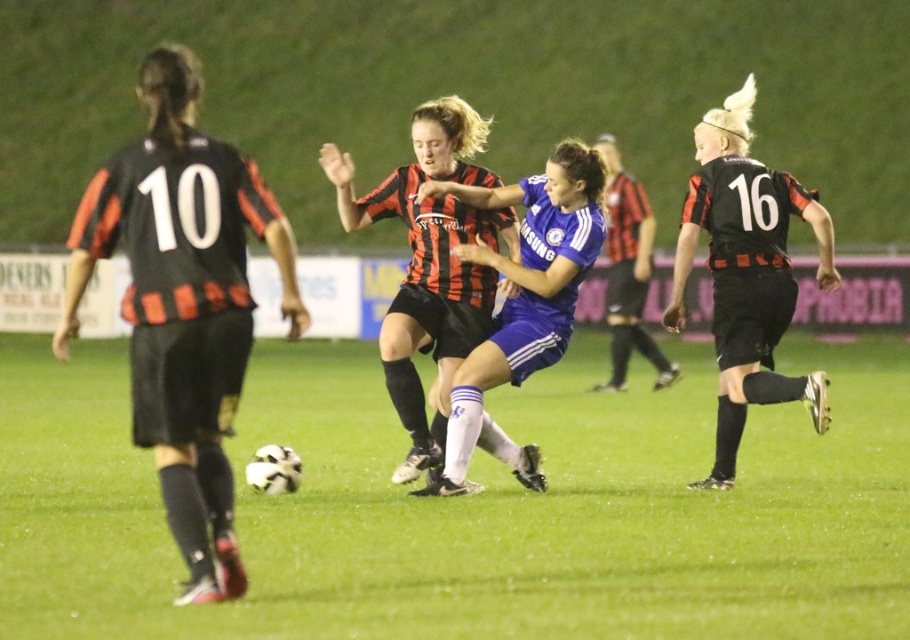
Question: Can you confirm if green grass football field at center is positioned to the left of blue jersey at center?

Choices:
 (A) no
 (B) yes

Answer: (B)

Question: Among these points, which one is farthest from the camera?

Choices:
 (A) (552, 164)
 (B) (468, 349)
 (C) (883, 403)

Answer: (C)

Question: Which of the following is the closest to the observer?

Choices:
 (A) blue jersey at center
 (B) matte black jersey at center

Answer: (B)

Question: Does matte black jersey at center appear under blue jersey at center?

Choices:
 (A) yes
 (B) no

Answer: (B)

Question: Is green grass football field at center positioned at the back of matte black jersey at center?

Choices:
 (A) no
 (B) yes

Answer: (A)

Question: Which point is closer to the camera?

Choices:
 (A) matte black jersey at center
 (B) blue jersey at center
 (C) green grass football field at center

Answer: (C)